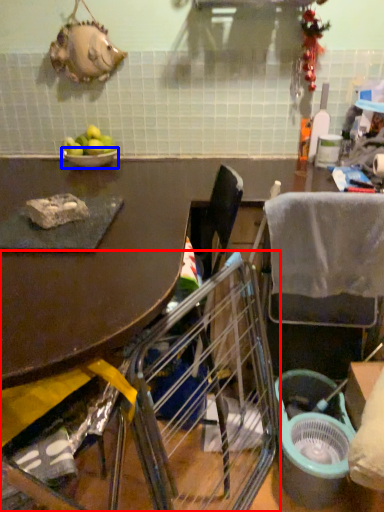
Question: Which of the following is the closest to the observer, chair (highlighted by a red box) or bowl (highlighted by a blue box)?

Choices:
 (A) chair
 (B) bowl

Answer: (A)